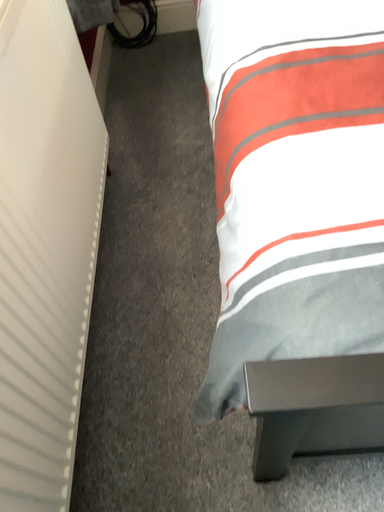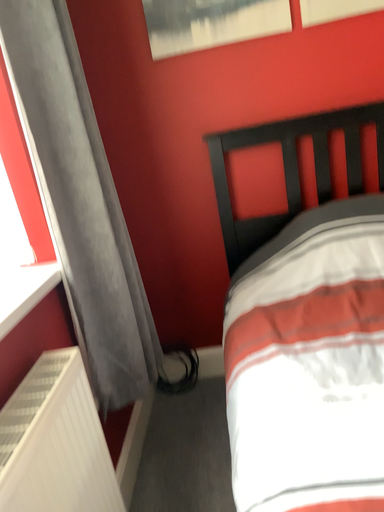
Question: Which way did the camera rotate in the video?

Choices:
 (A) rotated left
 (B) rotated right

Answer: (A)